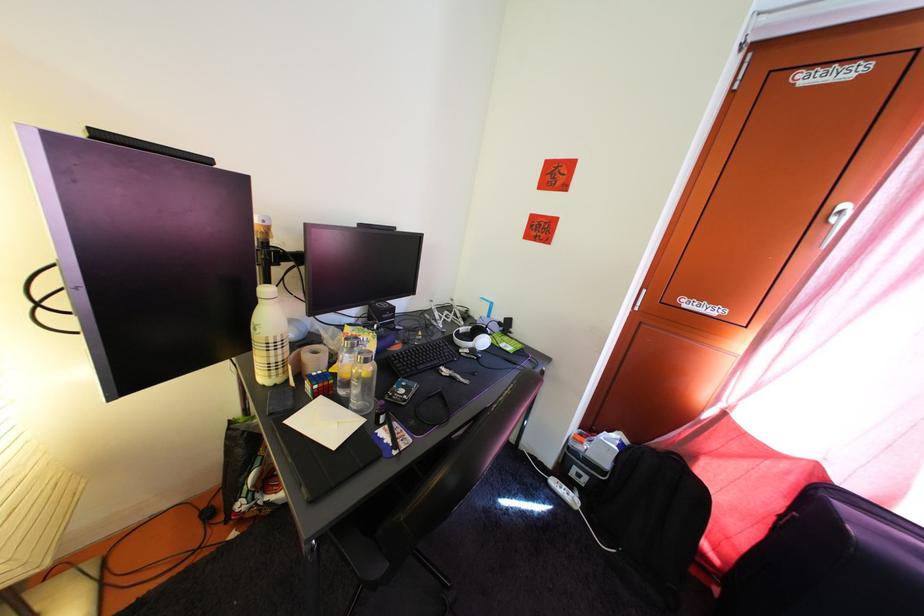
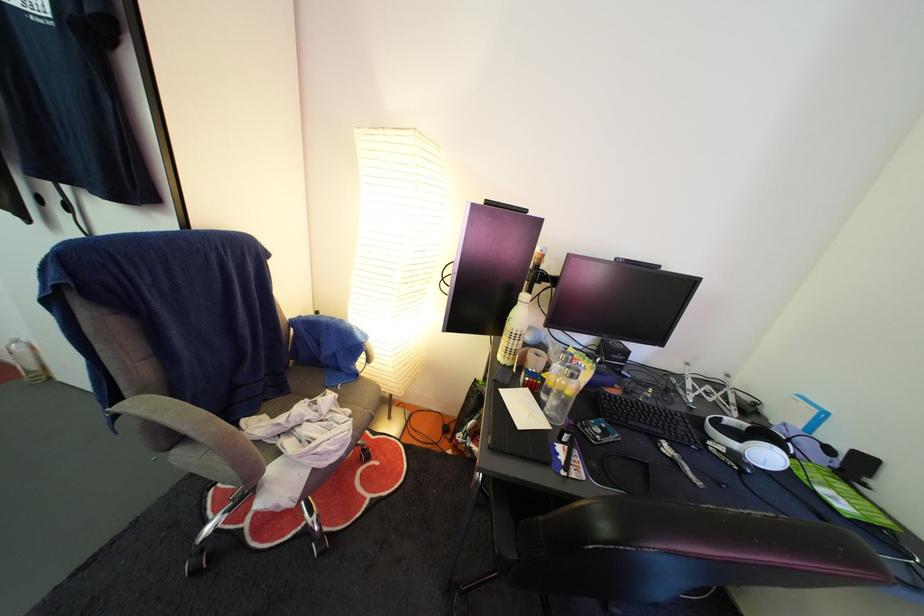
Question: Based on the continuous images, in which direction is the camera rotating? Reply with the corresponding letter.

Choices:
 (A) Left
 (B) Right
 (C) Up
 (D) Down

Answer: (A)